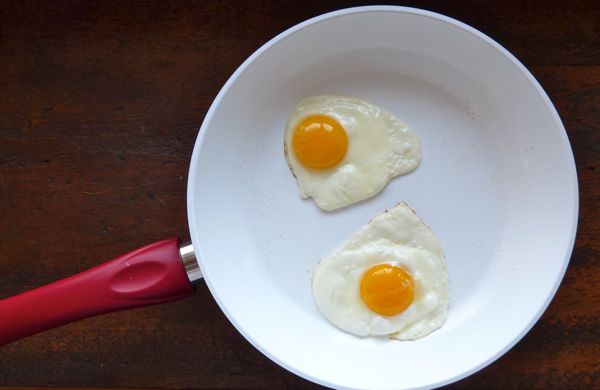
Image resolution: width=600 pixels, height=390 pixels. What are the coordinates of `table` in the screenshot? It's located at (110, 186).